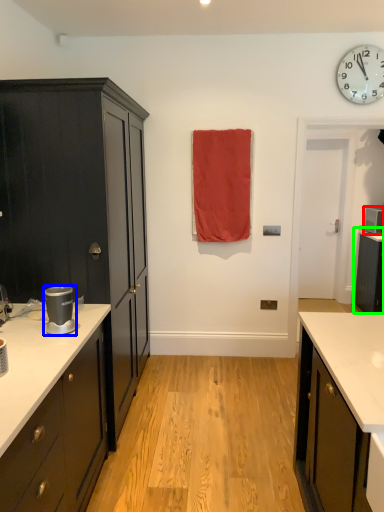
Question: Considering the real-world distances, which object is farthest from appliance (highlighted by a red box)? appliance (highlighted by a blue box) or cabinetry (highlighted by a green box)?

Choices:
 (A) appliance
 (B) cabinetry

Answer: (A)